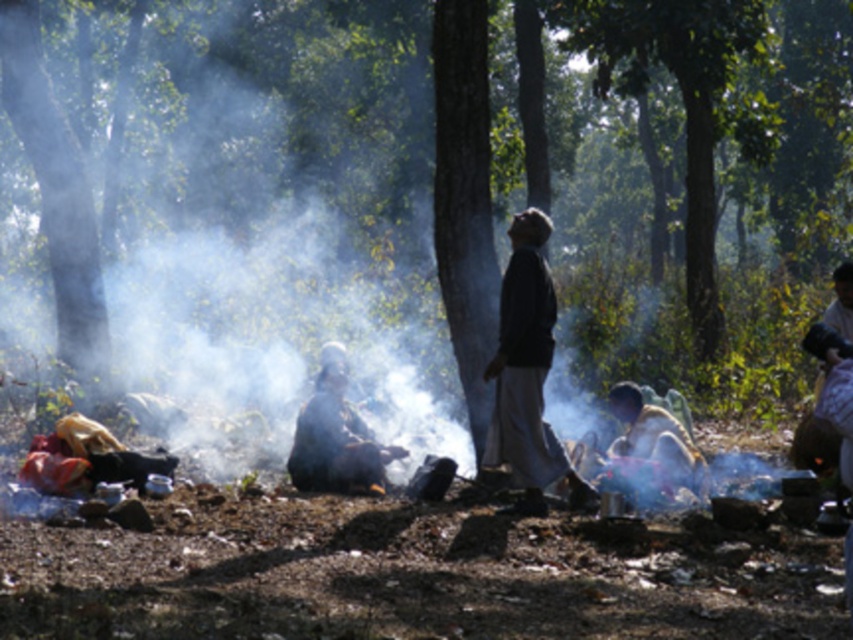
You are standing in the wooded area and want to place a small item on the dark brown fabric at center. Where exactly should you aim to place it?

The dark brown fabric at center is located at point (526, 371), so you should aim for those coordinates to place the item there.

You are standing at the campfire in the wooded area and see two points marked on the ground. One is at point [537,472] and the other at point [331,410]. Which point is closer to you?

Point [537,472] is in front of point [331,410], so it is closer to you.

You are planning to set up a picnic blanket in the wooded area. You have two options available in the scene, the dark gray fabric at center and the floral fabric dress at right. Which fabric would provide more space for your picnic setup?

The floral fabric dress at right is larger than the dark gray fabric at center, so it would provide more space for the picnic setup.